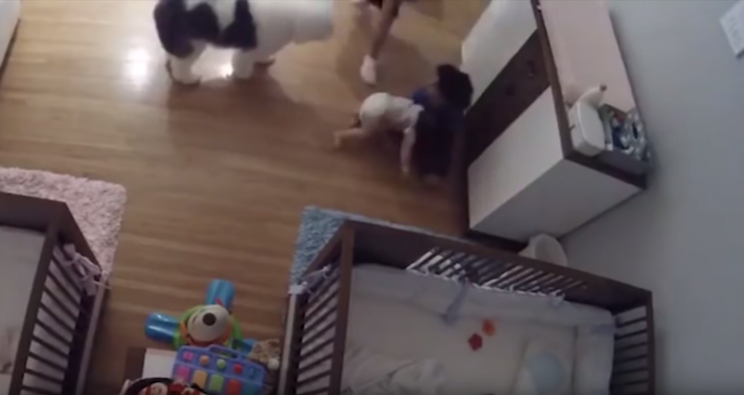
The height and width of the screenshot is (395, 744). Identify the location of space inside crib. (18, 247).